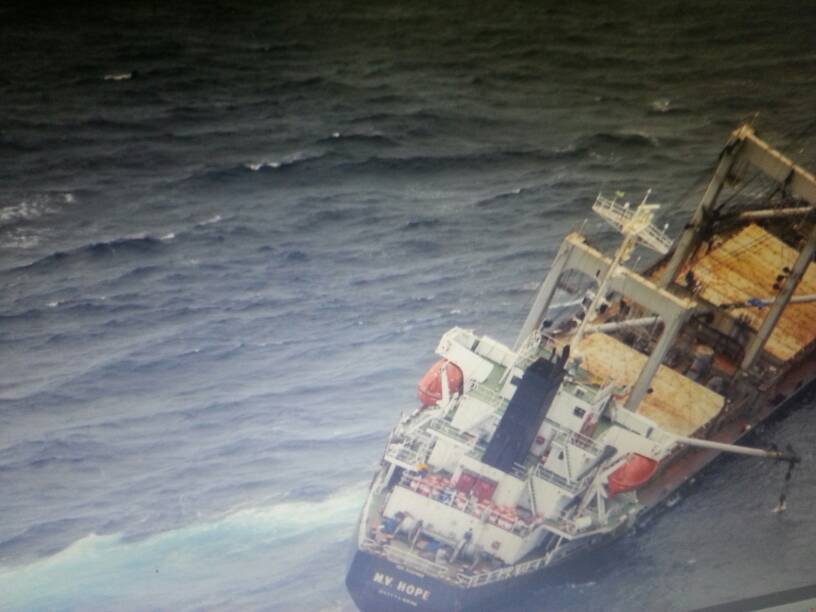
Identify the location of windows. (577, 412), (513, 382).